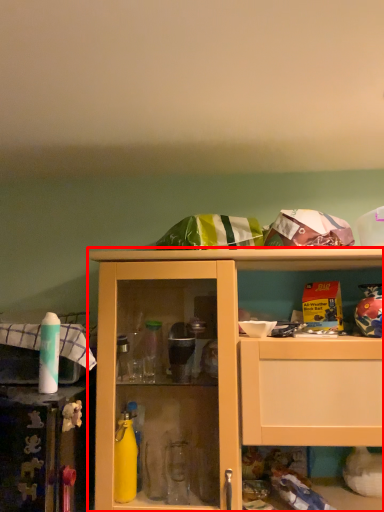
Question: From the image's perspective, where is cabinetry (annotated by the red box) located in relation to bottle in the image?

Choices:
 (A) below
 (B) above

Answer: (A)